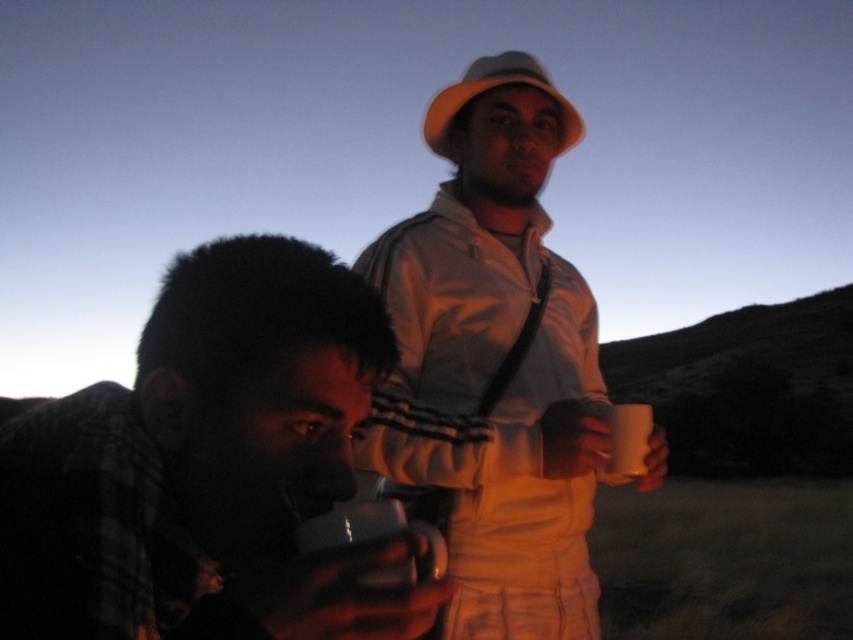
Question: Among these objects, which one is farthest from the camera?

Choices:
 (A) white glossy mug at lower center
 (B) white matte mug at upper center
 (C) matte black mug at lower left

Answer: (B)

Question: Which of the following is the farthest from the observer?

Choices:
 (A) white matte mug at upper center
 (B) white matte jacket at center

Answer: (A)

Question: Does white matte jacket at center lie behind white matte mug at upper center?

Choices:
 (A) no
 (B) yes

Answer: (A)

Question: Is white matte jacket at center positioned in front of white matte mug at upper center?

Choices:
 (A) yes
 (B) no

Answer: (A)

Question: Which of the following is the closest to the observer?

Choices:
 (A) (544, 522)
 (B) (368, 579)
 (C) (289, 380)

Answer: (B)

Question: Is white matte jacket at center below white glossy mug at lower center?

Choices:
 (A) yes
 (B) no

Answer: (B)